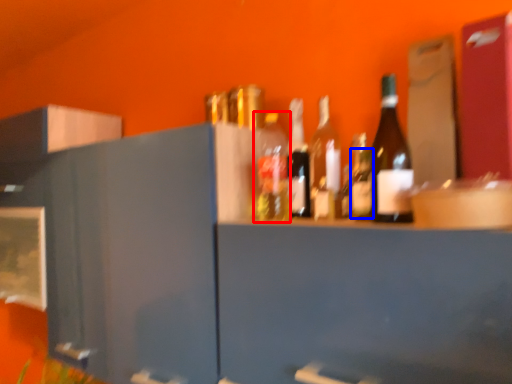
Question: Which object appears farthest to the camera in this image, bottle (highlighted by a red box) or bottle (highlighted by a blue box)?

Choices:
 (A) bottle
 (B) bottle

Answer: (A)